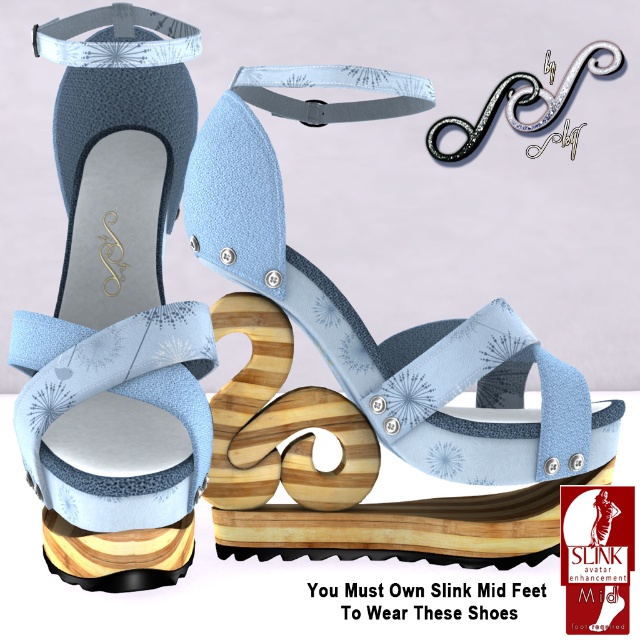
Question: Which object is positioned farthest from the light blue suede sandal at center?

Choices:
 (A) white textured fabric strap at upper left
 (B) satin silver strap at upper center

Answer: (B)

Question: Which object is the farthest from the satin silver strap at upper center?

Choices:
 (A) white textured fabric strap at upper left
 (B) light blue fabric sandal at center

Answer: (B)

Question: Which point is closer to the camera?

Choices:
 (A) light blue fabric sandal at center
 (B) satin silver strap at upper center
 (C) white textured fabric strap at upper left
 (D) light blue fabric strap at upper center

Answer: (A)

Question: Can you confirm if light blue suede sandal at center is positioned above light blue fabric strap at upper center?

Choices:
 (A) no
 (B) yes

Answer: (A)

Question: Does light blue fabric strap at upper center appear over satin silver strap at upper center?

Choices:
 (A) yes
 (B) no

Answer: (B)

Question: Can you confirm if light blue suede sandal at center is smaller than white textured fabric strap at upper left?

Choices:
 (A) no
 (B) yes

Answer: (A)